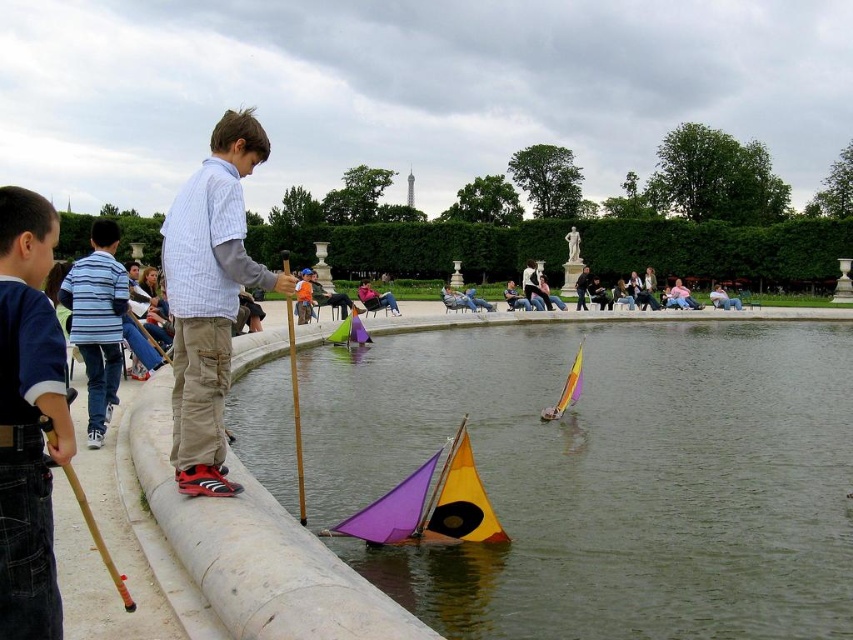
You are a parent at the park and want to ensure your child stays dry while playing near the transparent plastic water at center and the striped shirt at center. Based on their positions, is there enough space between them to avoid splashing?

The transparent plastic water at center might be wider than striped shirt at center, so there could be sufficient space between them to prevent splashing. However, since the exact distance isn not specified, caution is advised to ensure safety.

You are a photographer trying to capture a candid shot of the children playing near the Eiffel Tower. You notice the blue denim jeans at lower left and the striped shirt at center. Which object is closer to the camera based on their positions?

The blue denim jeans at lower left is positioned under the striped shirt at center, meaning it is closer to the camera.